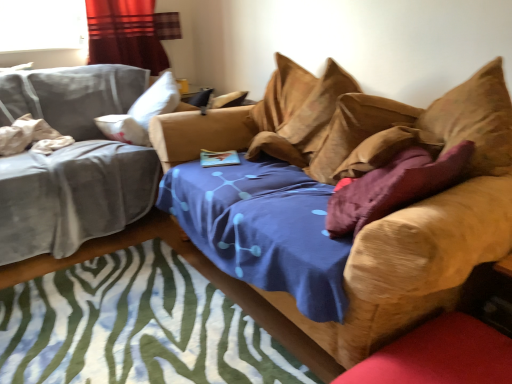
Question: Is white cotton pillow at left, placed as the fourth pillow when sorted from right to left, not inside suede-like tan pillow at upper center, which appears as the second pillow when viewed from the left?

Choices:
 (A) no
 (B) yes

Answer: (B)

Question: Can you confirm if white cotton pillow at left, which is the 1th pillow from left to right, is bigger than suede-like tan pillow at upper center, marked as the third pillow in a right-to-left arrangement?

Choices:
 (A) yes
 (B) no

Answer: (B)

Question: From the image's perspective, is white cotton pillow at left, placed as the fourth pillow when sorted from right to left, located above suede-like tan pillow at upper center, which appears as the second pillow when viewed from the left?

Choices:
 (A) no
 (B) yes

Answer: (A)

Question: From a real-world perspective, is white cotton pillow at left, placed as the fourth pillow when sorted from right to left, positioned over suede-like tan pillow at upper center, marked as the third pillow in a right-to-left arrangement, based on gravity?

Choices:
 (A) yes
 (B) no

Answer: (B)

Question: Is white cotton pillow at left, placed as the fourth pillow when sorted from right to left, positioned in front of suede-like tan pillow at upper center, marked as the third pillow in a right-to-left arrangement?

Choices:
 (A) no
 (B) yes

Answer: (A)

Question: Is velvet purple pillow at center, which is the second pillow in right-to-left order, inside the boundaries of suede-like brown pillow at upper right, acting as the 1th pillow starting from the right, or outside?

Choices:
 (A) inside
 (B) outside

Answer: (B)

Question: From the image's perspective, is velvet purple pillow at center, which is the second pillow in right-to-left order, above or below suede-like brown pillow at upper right, acting as the 1th pillow starting from the right?

Choices:
 (A) above
 (B) below

Answer: (B)

Question: Relative to suede-like brown pillow at upper right, arranged as the 4th pillow when viewed from the left, is velvet purple pillow at center, which is the second pillow in right-to-left order, in front or behind?

Choices:
 (A) front
 (B) behind

Answer: (B)

Question: In terms of width, does velvet purple pillow at center, which is the second pillow in right-to-left order, look wider or thinner when compared to suede-like brown pillow at upper right, arranged as the 4th pillow when viewed from the left?

Choices:
 (A) wide
 (B) thin

Answer: (A)

Question: Is velvet gray studio couch at left, the 1th studio couch viewed from the left, spatially inside white cotton pillow at left, placed as the fourth pillow when sorted from right to left, or outside of it?

Choices:
 (A) inside
 (B) outside

Answer: (B)

Question: Is velvet gray studio couch at left, the 1th studio couch viewed from the left, in front of or behind white cotton pillow at left, which is the 1th pillow from left to right, in the image?

Choices:
 (A) behind
 (B) front

Answer: (B)

Question: In terms of height, does velvet gray studio couch at left, which is the second studio couch from right to left, look taller or shorter compared to white cotton pillow at left, placed as the fourth pillow when sorted from right to left?

Choices:
 (A) tall
 (B) short

Answer: (A)

Question: Is velvet gray studio couch at left, the 1th studio couch viewed from the left, to the left or to the right of white cotton pillow at left, placed as the fourth pillow when sorted from right to left, in the image?

Choices:
 (A) left
 (B) right

Answer: (B)

Question: From the image's perspective, relative to velvet purple pillow at center, which is the second pillow in right-to-left order, is velvet curtain at upper left above or below?

Choices:
 (A) below
 (B) above

Answer: (B)

Question: Considering the positions of point (160, 54) and point (384, 104), is point (160, 54) closer or farther from the camera than point (384, 104)?

Choices:
 (A) closer
 (B) farther

Answer: (B)